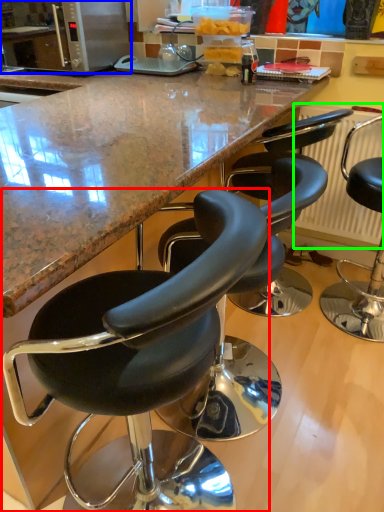
Question: Estimate the real-world distances between objects in this image. Which object is farther from chair (highlighted by a red box), microwave oven (highlighted by a blue box) or radiator (highlighted by a green box)?

Choices:
 (A) microwave oven
 (B) radiator

Answer: (A)